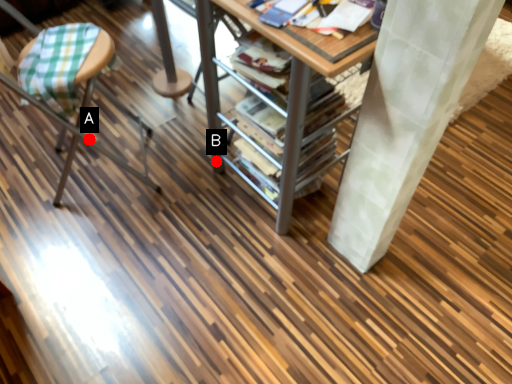
Question: Two points are circled on the image, labeled by A and B beside each circle. Among these points, which one is farthest from the camera?

Choices:
 (A) A is further
 (B) B is further

Answer: (A)